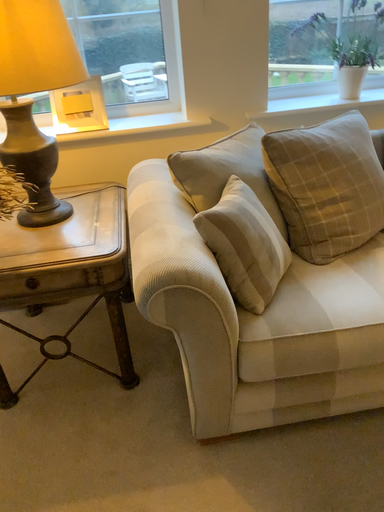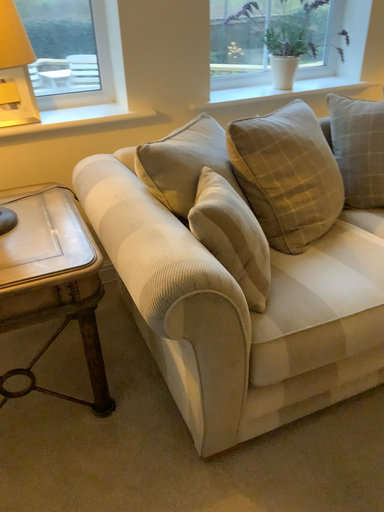
Question: Which way did the camera rotate in the video?

Choices:
 (A) rotated right
 (B) rotated left

Answer: (A)